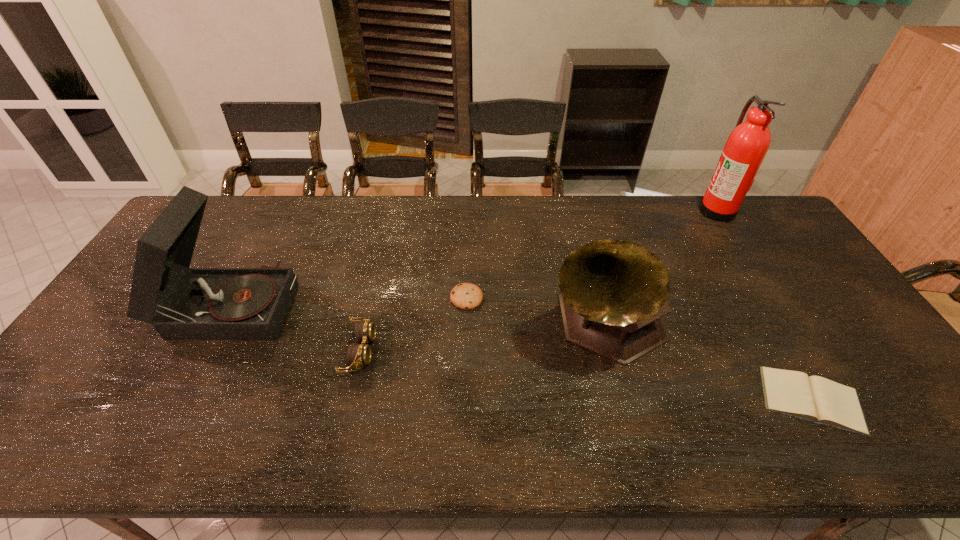
This screenshot has width=960, height=540. In order to click on free location that satisfies the following two spatial constraints: 1. through the lenses of the Bible; 2. on the left side of the goggles in this screenshot , I will do `click(348, 400)`.

The image size is (960, 540). What are the coordinates of `vacant position in the image that satisfies the following two spatial constraints: 1. through the lenses of the fifth object from right to left; 2. on the back side of the shortest object` in the screenshot? It's located at (348, 400).

Where is `vacant region that satisfies the following two spatial constraints: 1. on the label side of the fire extinguisher; 2. on the front side of the fourth object from right to left`? vacant region that satisfies the following two spatial constraints: 1. on the label side of the fire extinguisher; 2. on the front side of the fourth object from right to left is located at coordinates coord(772,298).

What are the coordinates of `free location that satisfies the following two spatial constraints: 1. on the horn direction of the third object from right to left; 2. through the lenses of the fourth tallest object` in the screenshot? It's located at (612, 351).

Locate an element on the screen. vacant space that satisfies the following two spatial constraints: 1. on the horn direction of the third object from right to left; 2. through the lenses of the goggles is located at coordinates [612, 351].